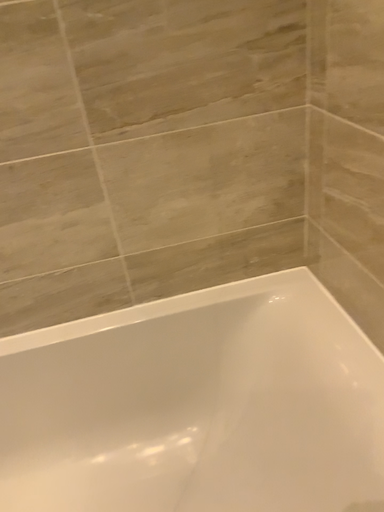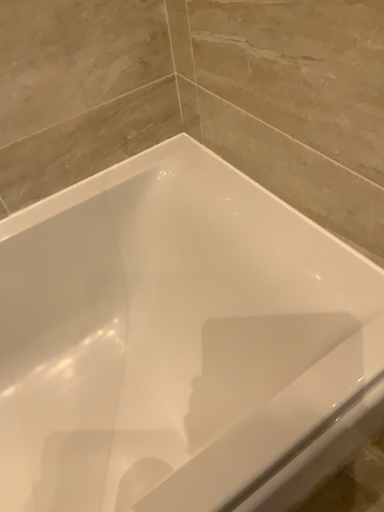
Question: How did the camera likely rotate when shooting the video?

Choices:
 (A) rotated downward
 (B) rotated upward

Answer: (A)